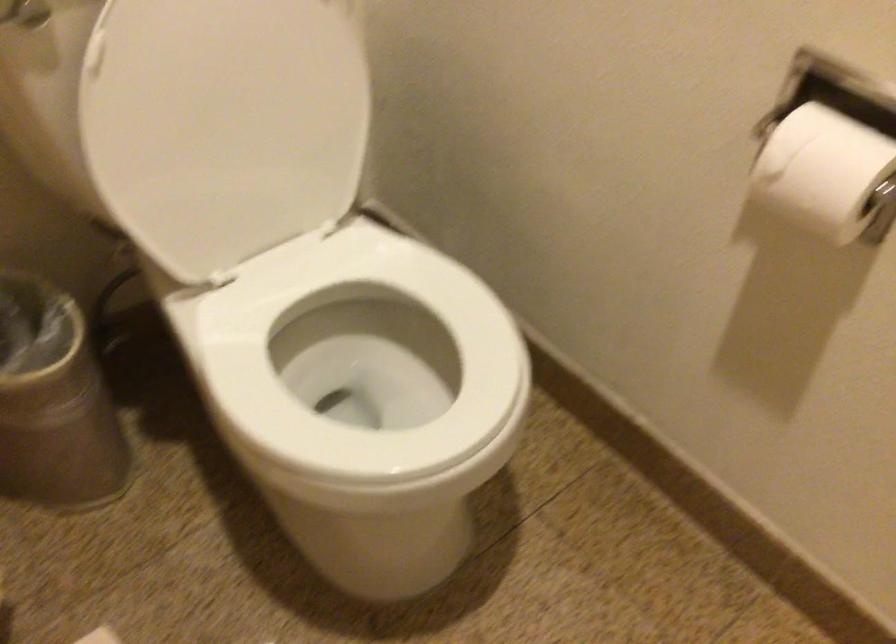
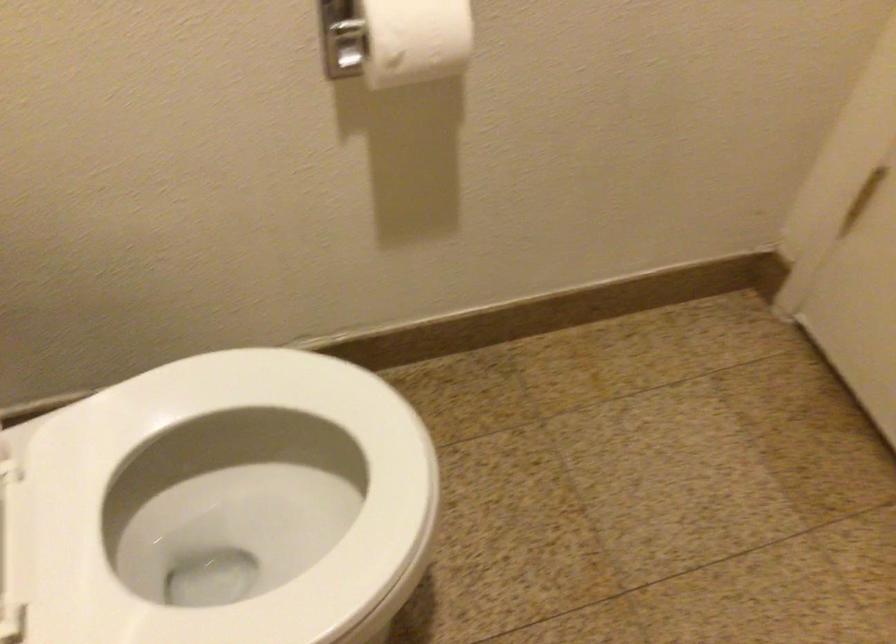
Based on the continuous images, in which direction is the camera rotating?

The camera's rotation is toward right-down.